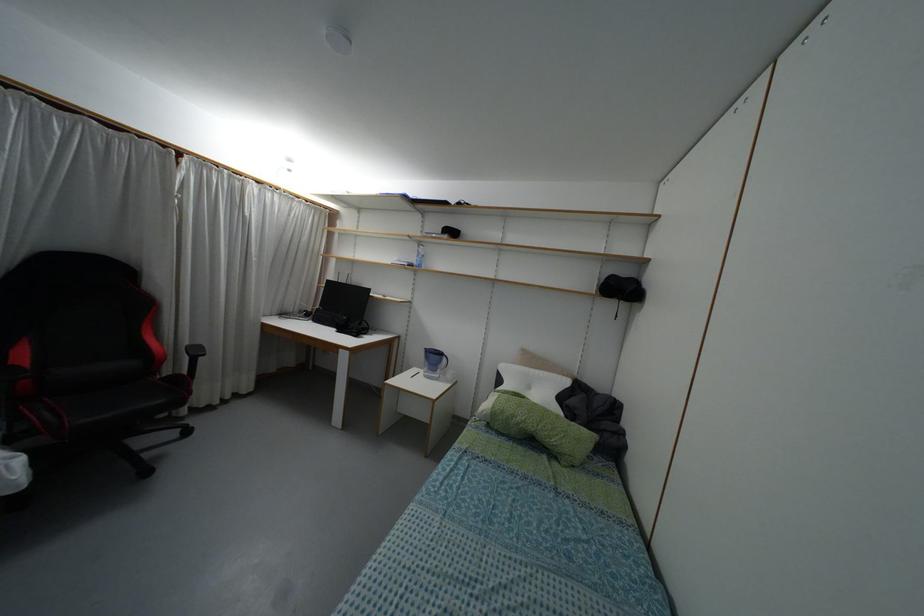
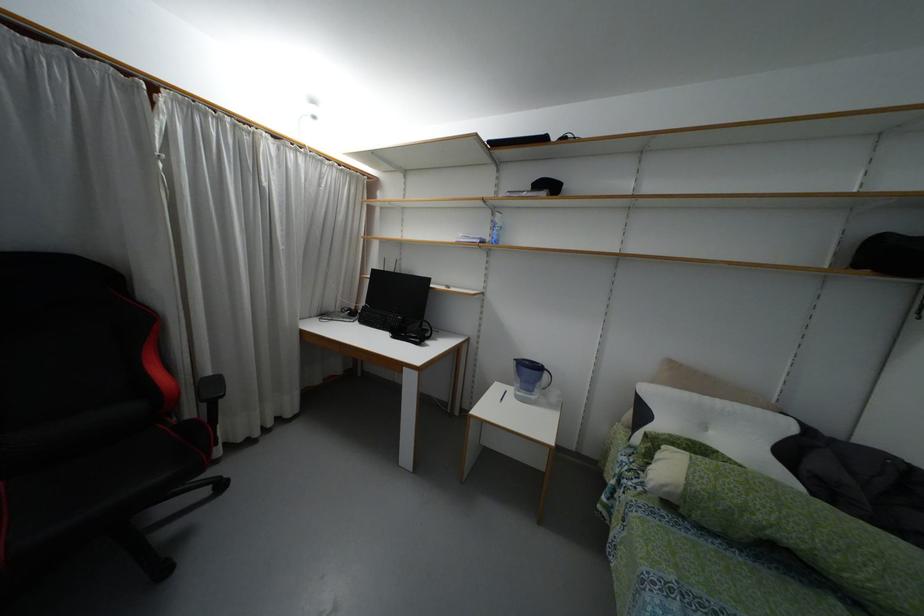
The point at (x=444, y=359) is marked in the first image. Where is the corresponding point in the second image?

(544, 375)